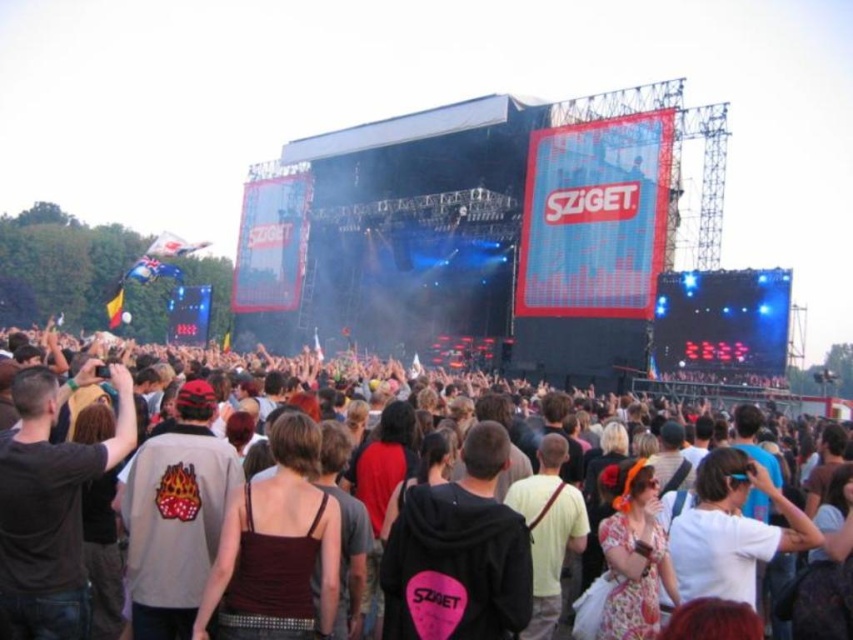
You are a photographer at the concert and want to capture a clear photo of the dark brown fabric tank top at center. Considering the brown fabric crowd at center, will the tank top be visible in the photo?

The brown fabric crowd at center has a greater height compared to the dark brown fabric tank top at center, so the tank top may be obscured by the crowd in the photo.

You are a photographer at the concert and want to capture a photo of the dark brown fabric tank top at center without the brown fabric crowd at center blocking it. Based on their positions, which side should you move to in order to frame the tank top without the crowd?

The brown fabric crowd at center is on the right side of the dark brown fabric tank top at center, so moving to the left side of the tank top would allow you to frame it without the crowd blocking the view.

In the scene shown: You are a photographer at the concert and want to capture a photo of the dark brown fabric tank top at center without the brown fabric crowd at center blocking it. Is this possible based on their positions?

The brown fabric crowd at center is closer to the viewer than the dark brown fabric tank top at center, so the crowd would block the view of the tank top. It is not possible to capture the tank top without the crowd blocking it.